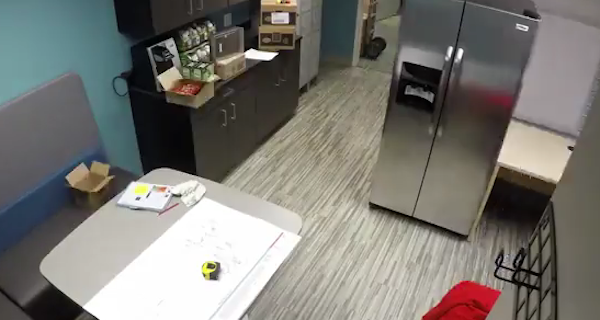
At what (x,y) coordinates should I click in order to perform the action: click on light blue painted wall. Please return your answer as a coordinate pair (x, y). This screenshot has height=320, width=600. Looking at the image, I should click on (339, 26), (93, 43), (20, 59), (120, 131).